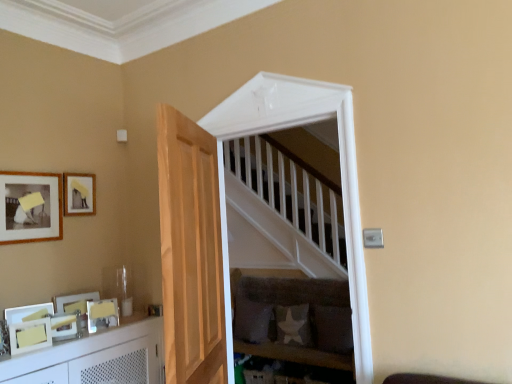
Question: Considering the positions of white fabric pillow at lower center, the 3th pillow viewed from the right, and matte gold picture frame at lower left, which is counted as the fourth picture frame, starting from the top, in the image, is white fabric pillow at lower center, the 3th pillow viewed from the right, taller or shorter than matte gold picture frame at lower left, which is counted as the fourth picture frame, starting from the top,?

Choices:
 (A) tall
 (B) short

Answer: (A)

Question: Is white fabric pillow at lower center, the 3th pillow viewed from the right, spatially inside matte gold picture frame at lower left, which is the 2th picture frame in bottom-to-top order, or outside of it?

Choices:
 (A) outside
 (B) inside

Answer: (A)

Question: Which object is the closest to the white wooden staircase at center?

Choices:
 (A) matte white picture frame at lower left, the 3th picture frame from the top
 (B) light brown wooden door at center
 (C) matte yellow picture frame at upper left, which is counted as the first picture frame, starting from the top
 (D) white glossy picture frame at lower left, acting as the 5th picture frame starting from the top
 (E) dark fabric pillow at lower center, the 3th pillow from the left

Answer: (B)

Question: Which of these objects is positioned farthest from the light brown wooden door at center?

Choices:
 (A) dark fabric pillow at lower center, the 3th pillow from the left
 (B) white wooden staircase at center
 (C) matte black picture frame at upper left, acting as the second picture frame starting from the top
 (D) white glossy cabinet at lower left
 (E) white glossy picture frame at lower left, placed as the 1th picture frame when sorted from bottom to top

Answer: (A)